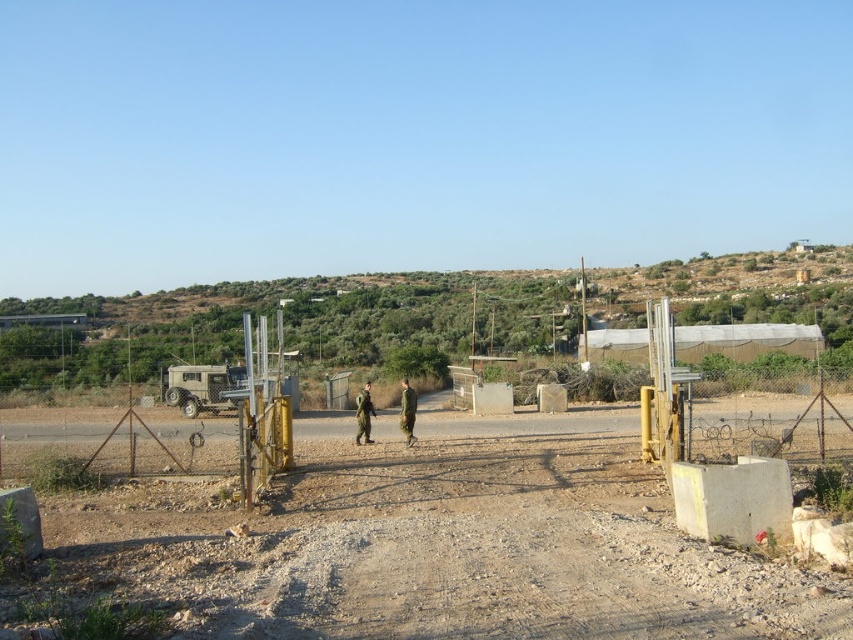
Who is more distant from viewer, [402,403] or [370,403]?

Positioned behind is point [370,403].

Does green military uniform at center have a greater height compared to green matte uniform at center?

Yes.

Is point (401, 388) farther from viewer compared to point (367, 401)?

Yes, point (401, 388) is farther from viewer.

Identify the location of green military uniform at center. (407, 412).